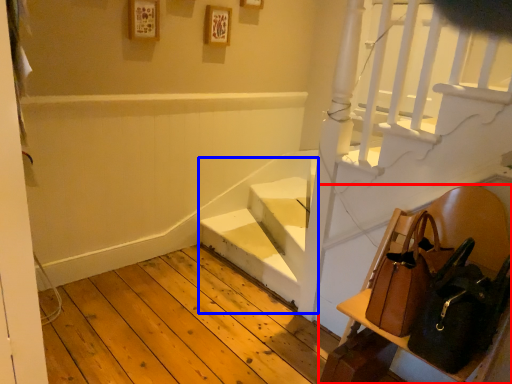
Question: Among these objects, which one is nearest to the camera, furniture (highlighted by a red box) or stairwell (highlighted by a blue box)?

Choices:
 (A) furniture
 (B) stairwell

Answer: (A)